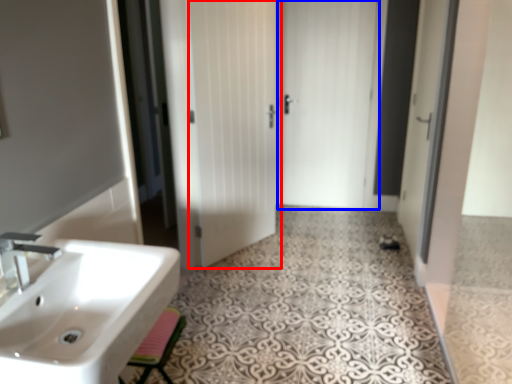
Question: Which object appears farthest to the camera in this image, door (highlighted by a red box) or door (highlighted by a blue box)?

Choices:
 (A) door
 (B) door

Answer: (B)